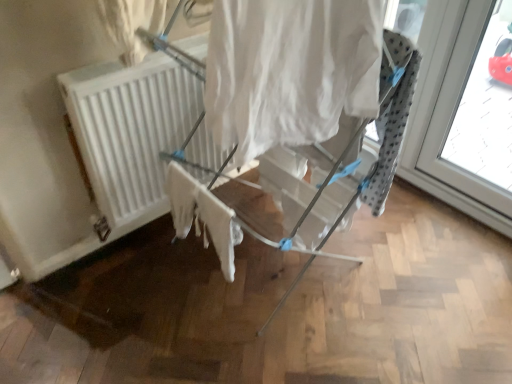
Locate an element on the screen. vacant region to the right of white fabric drying rack at center is located at coordinates (406, 271).